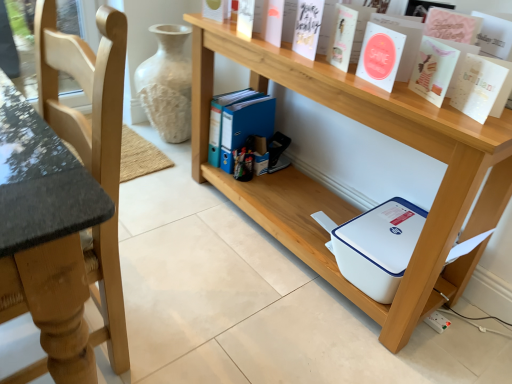
I want to click on vacant space to the left of white paper at upper center, positioned as the 3th paperback book in left-to-right order, so click(344, 75).